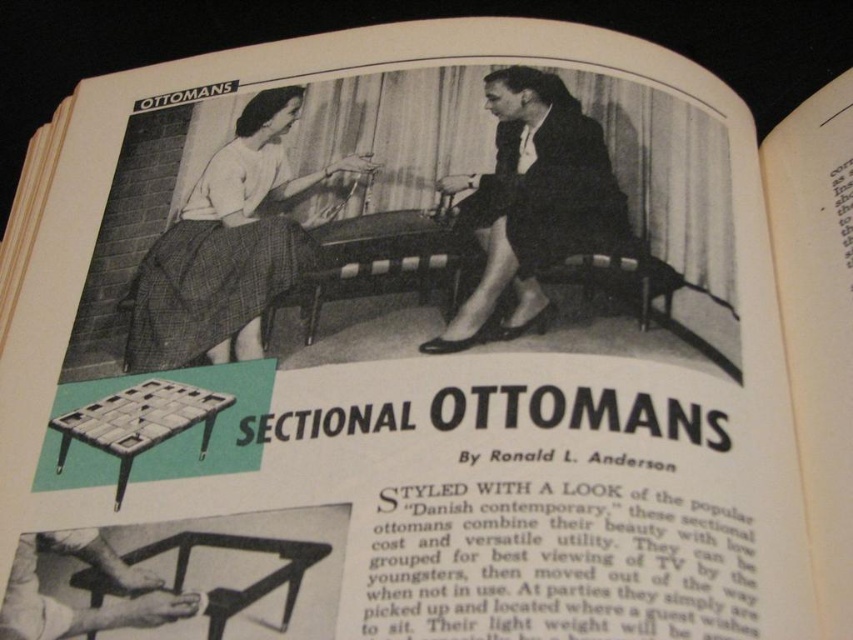
Question: Is the position of white woven skirt at upper left more distant than that of dark suit at center?

Choices:
 (A) no
 (B) yes

Answer: (B)

Question: Can you confirm if white woven skirt at upper left is positioned above dark suit at center?

Choices:
 (A) no
 (B) yes

Answer: (A)

Question: Is white woven skirt at upper left in front of dark suit at center?

Choices:
 (A) yes
 (B) no

Answer: (B)

Question: Which point is closer to the camera?

Choices:
 (A) (488, 211)
 (B) (262, 164)

Answer: (A)